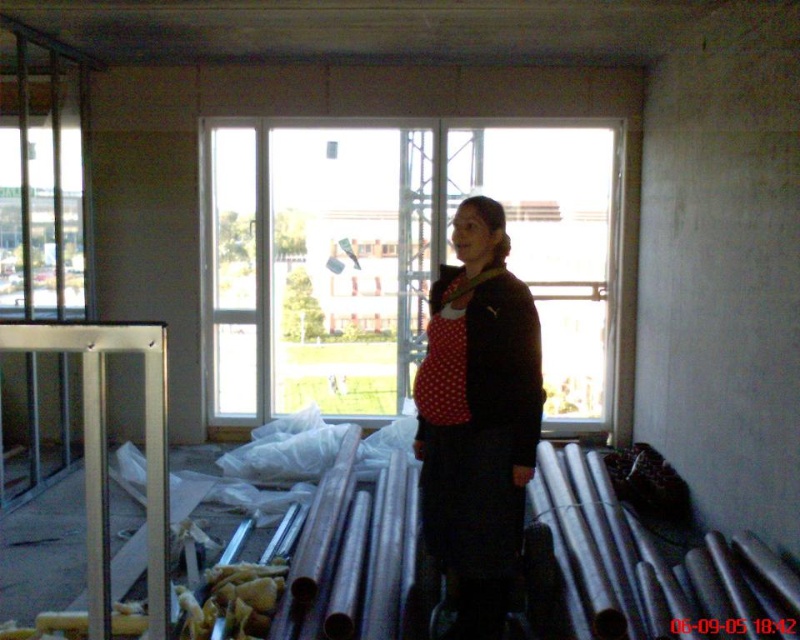
You are an interior designer assessing the space for a new window installation. The transparent glass window at center needs to be placed where the current window is located. Considering the existing polka dot fabric dress at center, will the new window fit in the same space?

The transparent glass window at center might be wider than the polka dot fabric dress at center, so it may not fit in the existing space unless adjustments are made.

You are an interior designer observing the construction site. You notice the transparent glass window at center and the polka dot fabric dress at center. Which object is taller?

The transparent glass window at center is much taller than the polka dot fabric dress at center according to the description.

You are a construction worker standing at the center of the room. You need to place a heavy tool on a point that is closer to the camera. Which point should you choose between point (254, 259) and point (517, 502)?

You should choose point (254, 259) because it is further to the camera than point (517, 502), making it closer to your current position at the center of the room.